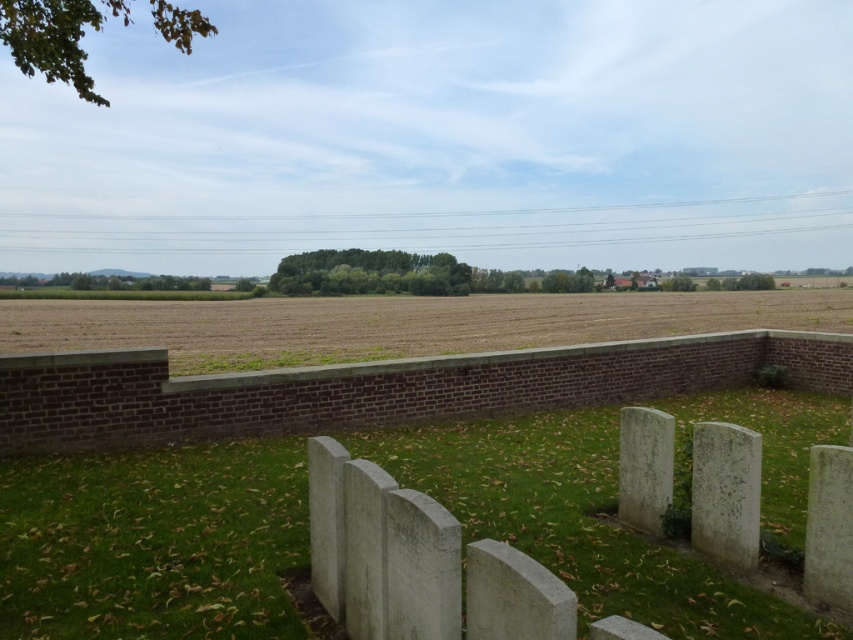
Question: Which object appears closest to the camera in this image?

Choices:
 (A) brown grassland at lower center
 (B) white stone markers at center
 (C) white stone gravestone at right

Answer: (B)

Question: Estimate the real-world distances between objects in this image. Which object is farther from the white stone gravestone at right?

Choices:
 (A) white stone markers at center
 (B) brown grassland at lower center

Answer: (B)

Question: Is white stone markers at center further to camera compared to white stone gravestone at right?

Choices:
 (A) yes
 (B) no

Answer: (B)

Question: From the image, what is the correct spatial relationship of white stone markers at center in relation to gray stone gravestone at lower right?

Choices:
 (A) below
 (B) above

Answer: (A)

Question: Among these objects, which one is farthest from the camera?

Choices:
 (A) white stone markers at center
 (B) white stone gravestone at right

Answer: (B)

Question: Considering the relative positions of white stone markers at center and brown grassland at lower center in the image provided, where is white stone markers at center located with respect to brown grassland at lower center?

Choices:
 (A) above
 (B) below

Answer: (B)